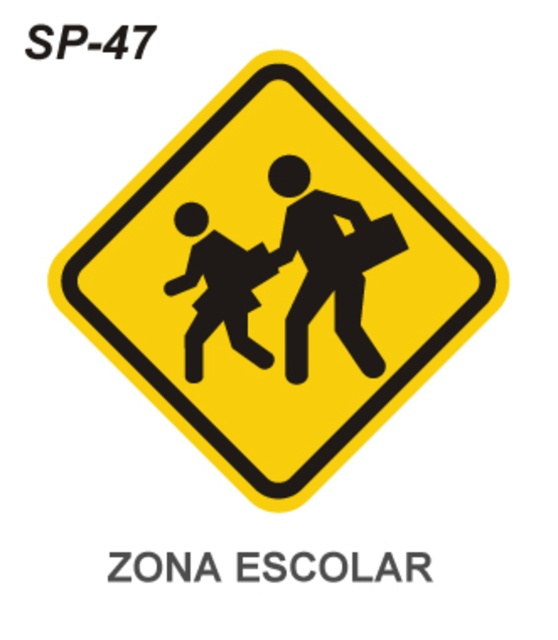
You are driving a car and see the yellow diamond road sign with the black silhouette at center ahead. If your car is 5.5 feet long, can you safely stop before reaching the sign without hitting it?

The distance between the black silhouette at center and the viewer is 4.82 feet. Since your car is 5.5 feet long, you cannot safely stop before reaching the sign without hitting it because the stopping distance would exceed the available space.

You are a pedestrian approaching the yellow matte sign at center and the black silhouette at lower left. Which object will you see as wider from your perspective?

The yellow matte sign at center is wider than the black silhouette at lower left, so you will see the yellow matte sign at center as wider.